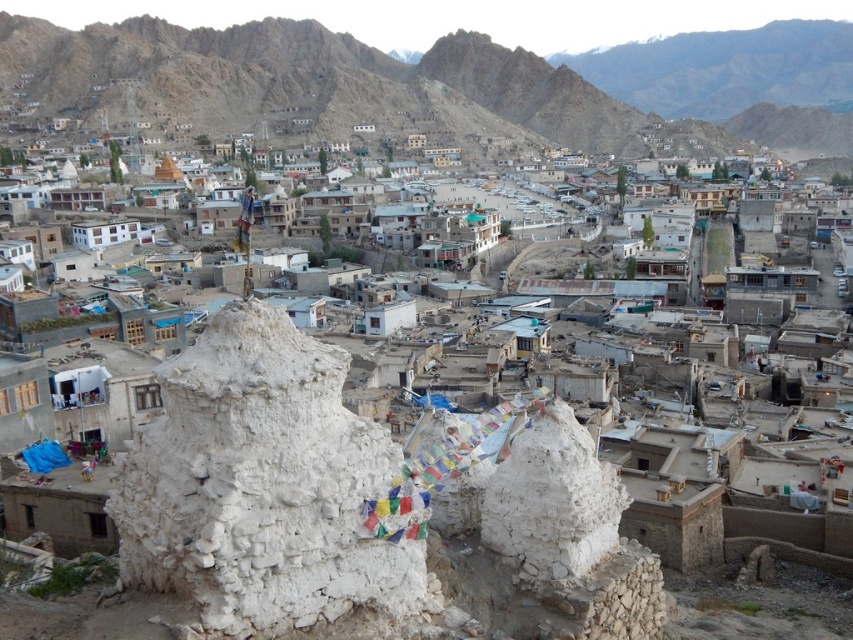
Where is `white clay stupa at center`? The image size is (853, 640). white clay stupa at center is located at coordinates (260, 484).

Based on the photo, between white clay stupa at center and white stone ruins at center, which one is positioned lower?

white clay stupa at center

Which is in front, point (225, 308) or point (691, 516)?

Point (225, 308) is in front.

Locate an element on the screen. The width and height of the screenshot is (853, 640). white clay stupa at center is located at coordinates (260, 484).

Can you confirm if rugged stone mountain at upper center is positioned below white stone ruins at center?

No, rugged stone mountain at upper center is not below white stone ruins at center.

Consider the image. Between rugged stone mountain at upper center and white stone ruins at center, which one has less height?

Standing shorter between the two is white stone ruins at center.

Who is more distant from viewer, (583, 102) or (740, 545)?

The point (583, 102) is more distant.

Find the location of `rugged stone mountain at upper center`. rugged stone mountain at upper center is located at coordinates (x=358, y=84).